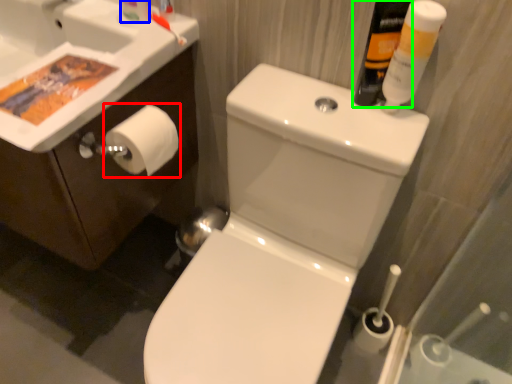
Question: Which is nearer to the toilet paper (highlighted by a red box)? toiletry (highlighted by a blue box) or mouthwash (highlighted by a green box).

Choices:
 (A) toiletry
 (B) mouthwash

Answer: (A)